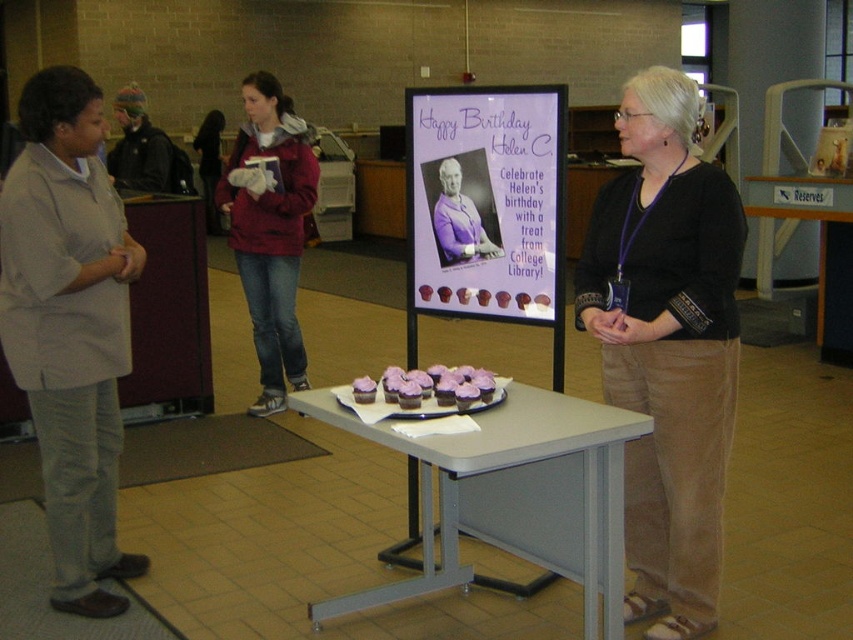
Question: Can you confirm if light gray shirt at left is bigger than purple fabric shirt at center?

Choices:
 (A) no
 (B) yes

Answer: (B)

Question: Considering the relative positions of black cotton shirt at center and metallic silver table at center in the image provided, where is black cotton shirt at center located with respect to metallic silver table at center?

Choices:
 (A) above
 (B) below

Answer: (B)

Question: Which is farther from the matte red jacket at center?

Choices:
 (A) purple paper poster at center
 (B) knitted wool hat at left
 (C) purple fabric shirt at center

Answer: (A)

Question: Does gray metal table at center lie behind matte red jacket at center?

Choices:
 (A) no
 (B) yes

Answer: (A)

Question: Which of the following is the closest to the observer?

Choices:
 (A) (537, 428)
 (B) (641, 563)
 (C) (254, 77)
 (D) (444, 394)

Answer: (A)

Question: Which point appears farthest from the camera in this image?

Choices:
 (A) (383, 588)
 (B) (447, 196)

Answer: (B)